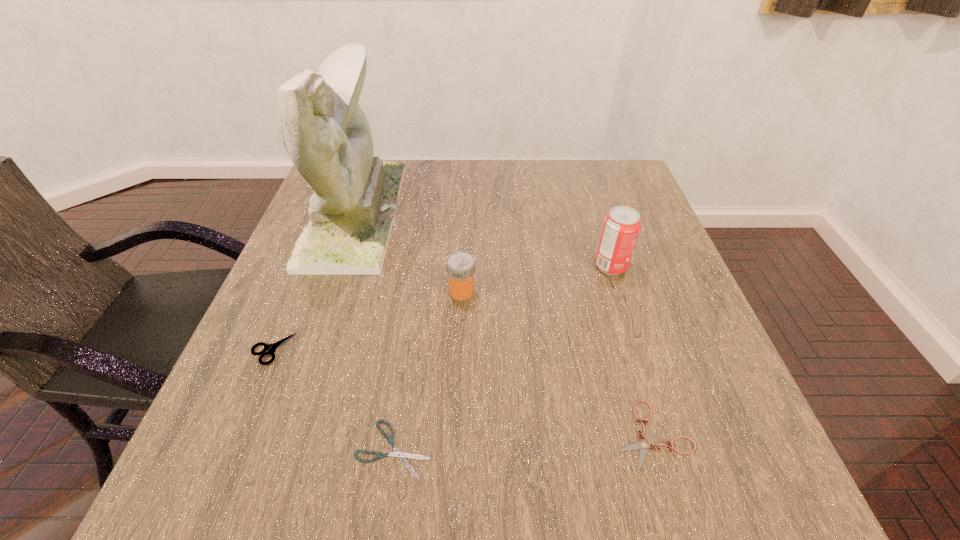
Identify the location of sculpture. (326, 134).

Identify the location of the second tallest object. (621, 226).

I want to click on medicine, so point(460,265).

I want to click on the third farthest object, so click(x=460, y=265).

At what (x,y) coordinates should I click in order to perform the action: click on the fourth tallest object. Please return your answer as a coordinate pair (x, y). Looking at the image, I should click on (270, 348).

You are a GUI agent. You are given a task and a screenshot of the screen. Output one action in this format:
    pyautogui.click(x=<x>, y=<y>)
    Task: Click on the farthest shears
    This screenshot has height=540, width=960.
    Given the screenshot: What is the action you would take?
    pyautogui.click(x=270, y=348)

In order to click on the rightmost shears in this screenshot , I will do `click(642, 444)`.

Find the location of a particular element. the third object from left to right is located at coordinates (397, 453).

In order to click on vacant space located on the base of the sculpture in this screenshot , I will do `click(541, 214)`.

You are a GUI agent. You are given a task and a screenshot of the screen. Output one action in this format:
    pyautogui.click(x=<x>, y=<y>)
    Task: Click on the free location located on the back of the soda can
    
    Given the screenshot: What is the action you would take?
    pyautogui.click(x=587, y=189)